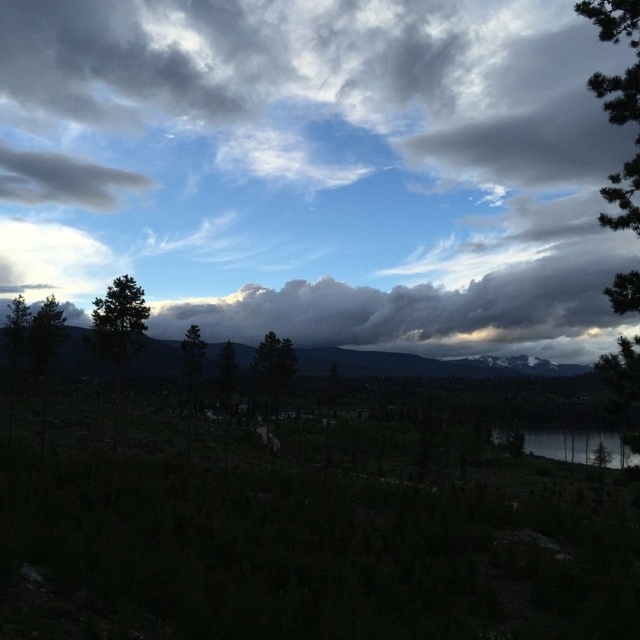
Question: Which object is positioned farthest from the green matte tree at left?

Choices:
 (A) dark gray rocky mountain at center
 (B) smooth reflective water at lower right
 (C) green matte tree at center
 (D) green textured pine tree at right

Answer: (A)

Question: Is green textured pine tree at right wider than smooth reflective water at lower right?

Choices:
 (A) yes
 (B) no

Answer: (A)

Question: Is cloudy sky at upper center positioned in front of smooth reflective water at lower right?

Choices:
 (A) no
 (B) yes

Answer: (A)

Question: Which point is farther to the camera?

Choices:
 (A) (264, 397)
 (B) (237, 134)
 (C) (624, 221)

Answer: (B)

Question: Which point is closer to the camera taking this photo?

Choices:
 (A) (625, 300)
 (B) (522, 364)
 (C) (285, 365)
 (D) (598, 442)

Answer: (A)

Question: Does cloudy sky at upper center appear on the right side of green matte tree at left?

Choices:
 (A) no
 (B) yes

Answer: (B)